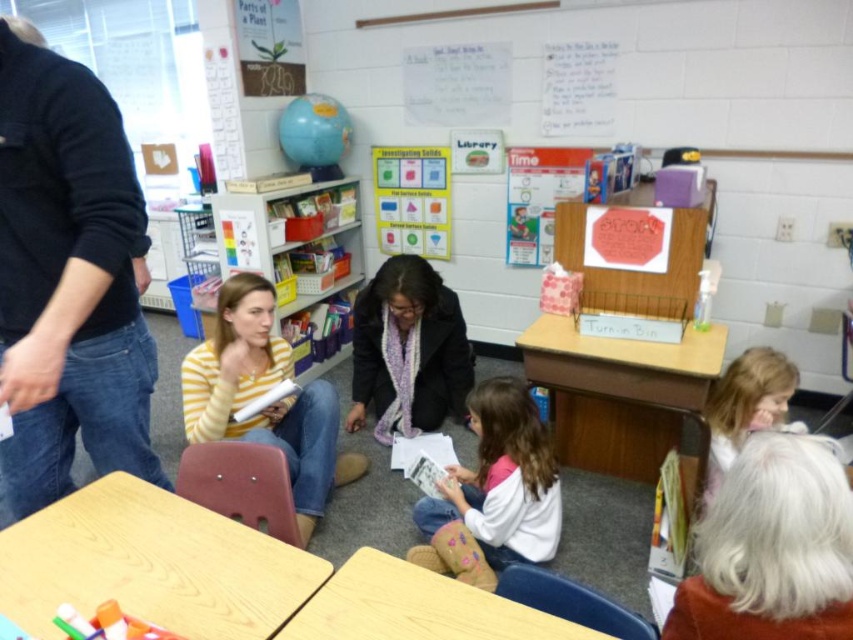
Can you confirm if wooden table at lower center is positioned below blonde hair at lower right?

Indeed, wooden table at lower center is positioned under blonde hair at lower right.

Is wooden table at lower center further to camera compared to blonde hair at lower right?

No, it is not.

Who is more distant from viewer, (x=523, y=612) or (x=764, y=413)?

The point (x=764, y=413) is more distant.

At what (x,y) coordinates should I click in order to perform the action: click on wooden table at lower center. Please return your answer as a coordinate pair (x, y). Looking at the image, I should click on (416, 608).

Is wooden at center to the right of blonde hair at lower right from the viewer's perspective?

No, wooden at center is not to the right of blonde hair at lower right.

Between point (582, 458) and point (769, 422), which one is positioned behind?

Positioned behind is point (582, 458).

Which is behind, point (556, 330) or point (758, 372)?

The point (556, 330) is behind.

Locate an element on the screen. The image size is (853, 640). wooden at center is located at coordinates (621, 394).

Between wooden table at lower left and wooden at center, which one appears on the left side from the viewer's perspective?

wooden table at lower left

Does wooden table at lower left appear under wooden at center?

Yes, wooden table at lower left is below wooden at center.

Identify the location of wooden table at lower left. The image size is (853, 640). (151, 564).

The height and width of the screenshot is (640, 853). I want to click on wooden table at lower left, so click(151, 564).